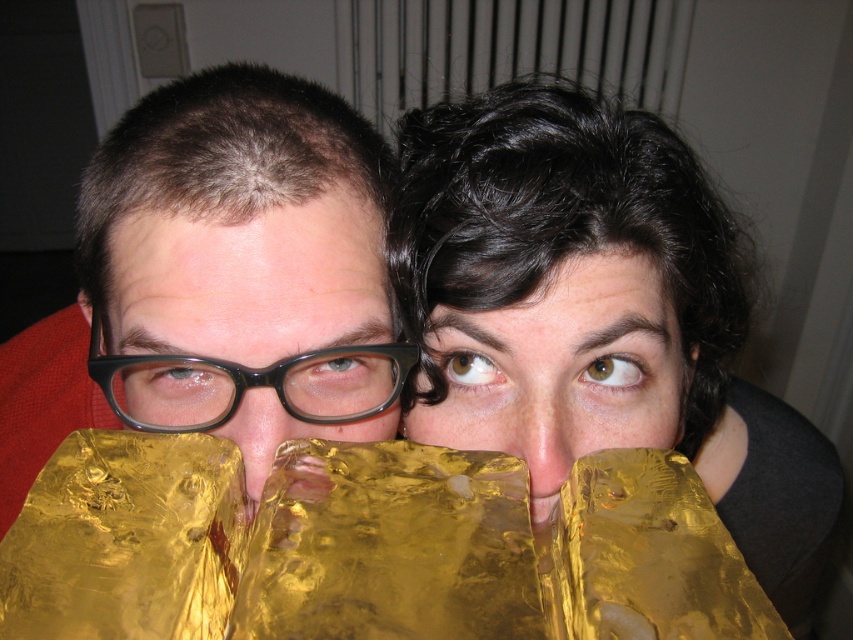
Question: From the image, what is the correct spatial relationship of shiny gold foil at upper right in relation to matte black glasses at center?

Choices:
 (A) right
 (B) left

Answer: (A)

Question: Which point is closer to the camera taking this photo?

Choices:
 (A) (593, 355)
 (B) (380, 419)
 (C) (209, 310)
 (D) (508, 388)

Answer: (C)

Question: Can you confirm if gold foil at left is wider than matte black glasses at center?

Choices:
 (A) no
 (B) yes

Answer: (B)

Question: Which point appears closest to the camera in this image?

Choices:
 (A) (173, 284)
 (B) (605, 432)
 (C) (126, 243)

Answer: (A)

Question: Which object is closer to the camera taking this photo?

Choices:
 (A) gold foil at left
 (B) shiny gold foil at upper right
 (C) matte black glasses at center
 (D) gold foil at center

Answer: (A)

Question: Does gold foil at left lie in front of gold foil at center?

Choices:
 (A) no
 (B) yes

Answer: (B)